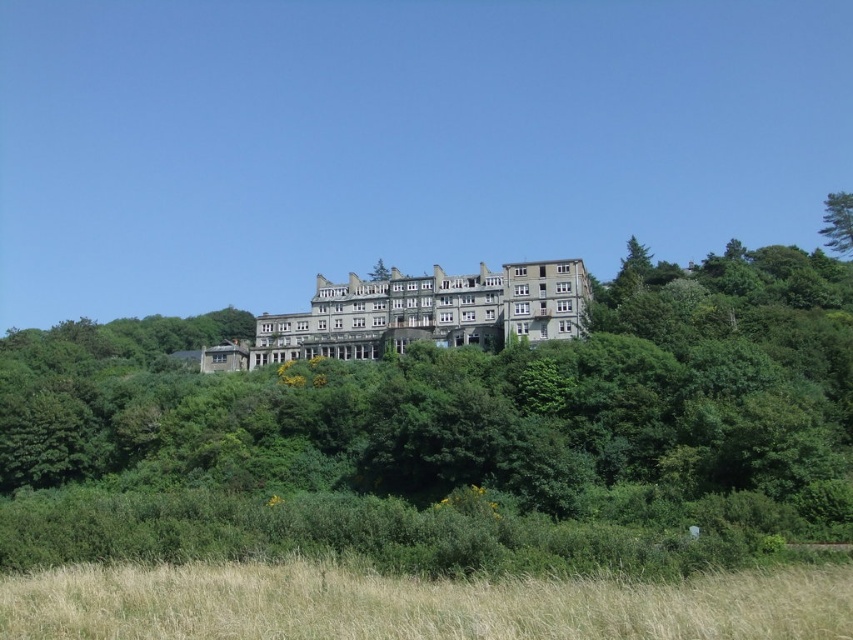
You are standing in the field of dry grass at lower center and want to reach the stone mansion at center. Which direction should you move to get closer to the mansion?

Since the dry grass at lower center is positioned on the right side of the stone mansion at center, you should move to the left to get closer to the mansion.

You are a landscape architect planning to plant a new row of trees in the area. Considering the green leafy tree at center and the dry grass at lower center, which one has a wider spread in terms of horizontal coverage?

The green leafy tree at center has a wider spread than the dry grass at lower center.